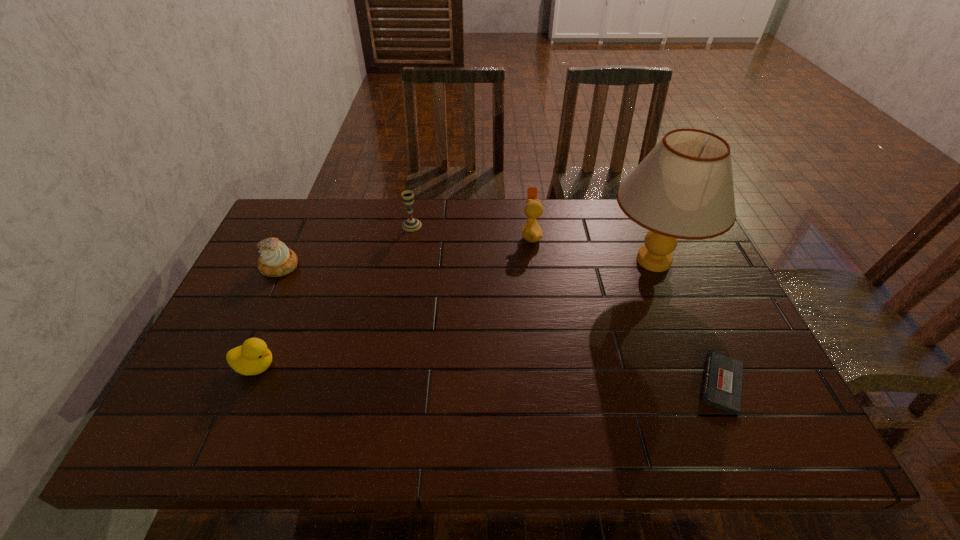
Locate an element on the screen. pastry present at the left edge is located at coordinates (276, 260).

Identify the location of duck present at the left edge. Image resolution: width=960 pixels, height=540 pixels. (253, 357).

Locate an element on the screen. lampshade that is at the right edge is located at coordinates (683, 189).

Find the location of a particular element. The height and width of the screenshot is (540, 960). videotape that is positioned at the right edge is located at coordinates (722, 384).

Identify the location of object located in the far right corner section of the desktop. The image size is (960, 540). (683, 189).

Image resolution: width=960 pixels, height=540 pixels. Identify the location of object that is positioned at the near right corner. [x=722, y=384].

This screenshot has height=540, width=960. Find the location of `blank space at the far edge of the desktop`. blank space at the far edge of the desktop is located at coordinates (383, 230).

Identify the location of free space at the right edge of the desktop. The width and height of the screenshot is (960, 540). (709, 322).

Locate an element on the screen. This screenshot has height=540, width=960. vacant space at the far left corner of the desktop is located at coordinates (315, 206).

Where is `free space between the pastry and the right duck`? Image resolution: width=960 pixels, height=540 pixels. free space between the pastry and the right duck is located at coordinates (405, 251).